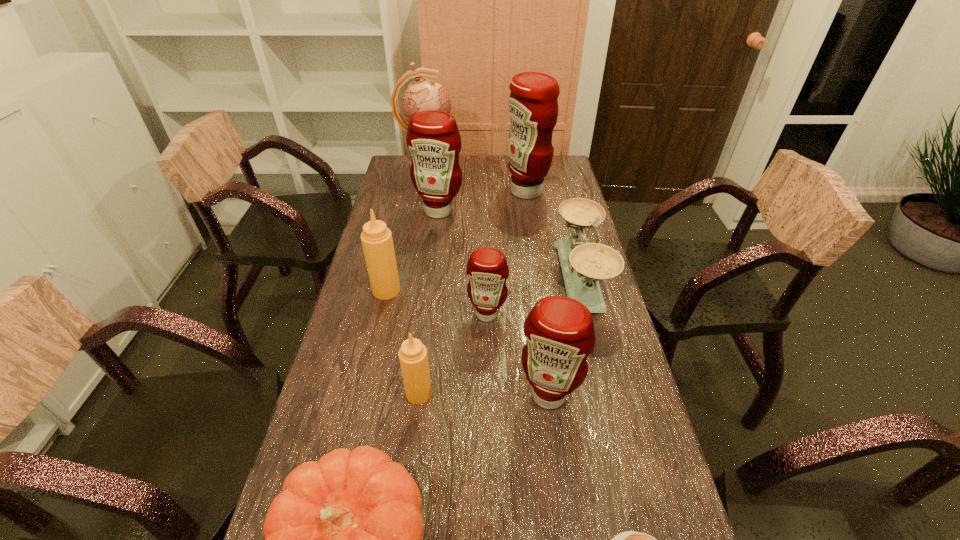
What are the coordinates of `condiment identified as the second closest to the fourth condiment from left to right` in the screenshot? It's located at (413, 357).

In order to click on condiment that stands as the third closest to the smaller tan condiment in this screenshot , I will do `click(376, 238)`.

Identify which red condiment is located as the second nearest to the nearest red condiment. Please provide its 2D coordinates. Your answer should be formatted as a tuple, i.e. [(x, y)], where the tuple contains the x and y coordinates of a point satisfying the conditions above.

[(433, 138)]

Find the location of a particular element. The height and width of the screenshot is (540, 960). red condiment that stands as the second closest to the biggest red condiment is located at coordinates (487, 268).

Find the location of `vacant area in the image that satisfies the following two spatial constraints: 1. on the front-facing side of the third red condiment from right to left; 2. on the right side of the farthest object`. vacant area in the image that satisfies the following two spatial constraints: 1. on the front-facing side of the third red condiment from right to left; 2. on the right side of the farthest object is located at coordinates (402, 314).

At what (x,y) coordinates should I click in order to perform the action: click on free location that satisfies the following two spatial constraints: 1. on the front-facing side of the globe; 2. on the left side of the biggest red condiment. Please return your answer as a coordinate pair (x, y). Image resolution: width=960 pixels, height=540 pixels. Looking at the image, I should click on [424, 191].